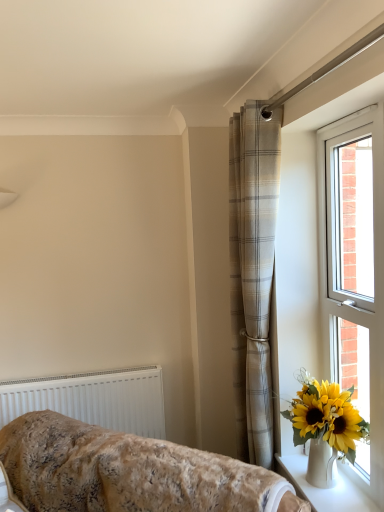
Question: Can you confirm if beige plaid curtain at center is thinner than white ceramic vase at lower right?

Choices:
 (A) yes
 (B) no

Answer: (A)

Question: Considering the relative sizes of beige plaid curtain at center and white ceramic vase at lower right in the image provided, is beige plaid curtain at center shorter than white ceramic vase at lower right?

Choices:
 (A) yes
 (B) no

Answer: (B)

Question: Is the depth of beige plaid curtain at center greater than that of white ceramic vase at lower right?

Choices:
 (A) yes
 (B) no

Answer: (A)

Question: Could you tell me if beige plaid curtain at center is facing white ceramic vase at lower right?

Choices:
 (A) yes
 (B) no

Answer: (B)

Question: Would you say white ceramic vase at lower right is part of beige plaid curtain at center's contents?

Choices:
 (A) no
 (B) yes

Answer: (A)

Question: Would you say fluffy beige blanket at lower left is to the left or to the right of white plastic radiator at lower left in the picture?

Choices:
 (A) right
 (B) left

Answer: (A)

Question: Which is correct: fluffy beige blanket at lower left is inside white plastic radiator at lower left, or outside of it?

Choices:
 (A) inside
 (B) outside

Answer: (B)

Question: Looking at their shapes, would you say fluffy beige blanket at lower left is wider or thinner than white plastic radiator at lower left?

Choices:
 (A) thin
 (B) wide

Answer: (B)

Question: From a real-world perspective, is fluffy beige blanket at lower left physically located above or below white plastic radiator at lower left?

Choices:
 (A) below
 (B) above

Answer: (A)

Question: From the image's perspective, is fluffy beige blanket at lower left positioned above or below white ceramic vase at lower right?

Choices:
 (A) below
 (B) above

Answer: (B)

Question: Is fluffy beige blanket at lower left inside or outside of white ceramic vase at lower right?

Choices:
 (A) outside
 (B) inside

Answer: (A)

Question: In the image, is fluffy beige blanket at lower left positioned in front of or behind white ceramic vase at lower right?

Choices:
 (A) behind
 (B) front

Answer: (B)

Question: Considering the relative positions of fluffy beige blanket at lower left and white ceramic vase at lower right in the image provided, is fluffy beige blanket at lower left to the left or to the right of white ceramic vase at lower right?

Choices:
 (A) right
 (B) left

Answer: (B)

Question: Would you say white ceramic vase at lower right is to the left or to the right of white plastic window at right in the picture?

Choices:
 (A) right
 (B) left

Answer: (B)

Question: In terms of height, does white ceramic vase at lower right look taller or shorter compared to white plastic window at right?

Choices:
 (A) tall
 (B) short

Answer: (B)